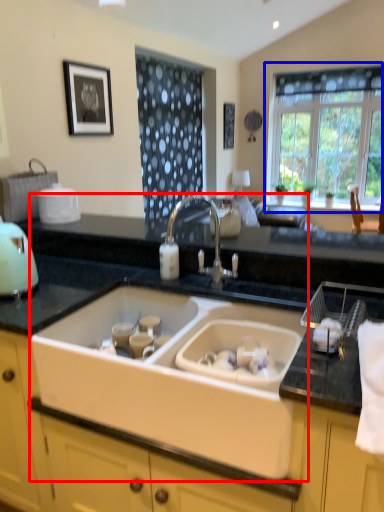
Question: Which object appears farthest to the camera in this image, sink (highlighted by a red box) or window (highlighted by a blue box)?

Choices:
 (A) sink
 (B) window

Answer: (B)